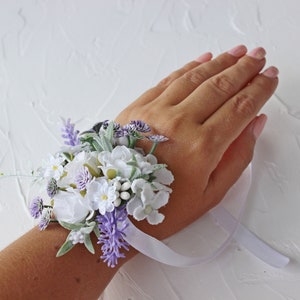
Find the location of `white textured wall`. white textured wall is located at coordinates (61, 73).